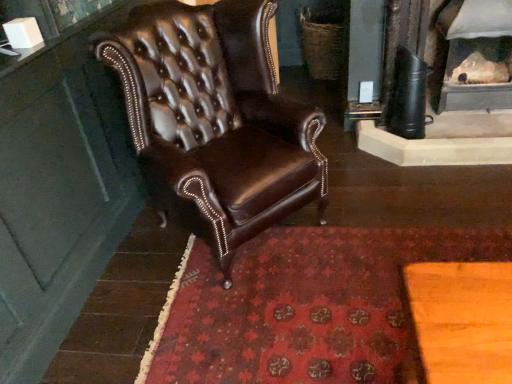
Question: Is red carpet at center shorter than white textured fireplace at upper right?

Choices:
 (A) no
 (B) yes

Answer: (B)

Question: Could you tell me if red carpet at center is turned towards white textured fireplace at upper right?

Choices:
 (A) no
 (B) yes

Answer: (A)

Question: Is red carpet at center at the left side of white textured fireplace at upper right?

Choices:
 (A) no
 (B) yes

Answer: (B)

Question: Considering the relative sizes of red carpet at center and white textured fireplace at upper right in the image provided, is red carpet at center taller than white textured fireplace at upper right?

Choices:
 (A) yes
 (B) no

Answer: (B)

Question: Considering the relative sizes of red carpet at center and white textured fireplace at upper right in the image provided, is red carpet at center bigger than white textured fireplace at upper right?

Choices:
 (A) no
 (B) yes

Answer: (A)

Question: From a real-world perspective, is red carpet at center beneath white textured fireplace at upper right?

Choices:
 (A) no
 (B) yes

Answer: (B)

Question: Is brown leather chair at center oriented away from red carpet at center?

Choices:
 (A) no
 (B) yes

Answer: (A)

Question: From the image's perspective, is brown leather chair at center above red carpet at center?

Choices:
 (A) yes
 (B) no

Answer: (A)

Question: Can you confirm if brown leather chair at center is wider than red carpet at center?

Choices:
 (A) no
 (B) yes

Answer: (A)

Question: From the image's perspective, is brown leather chair at center located beneath red carpet at center?

Choices:
 (A) yes
 (B) no

Answer: (B)

Question: Is red carpet at center inside brown leather chair at center?

Choices:
 (A) yes
 (B) no

Answer: (B)

Question: Can you confirm if brown leather chair at center is thinner than red carpet at center?

Choices:
 (A) no
 (B) yes

Answer: (B)

Question: From the image's perspective, would you say red carpet at center is shown under brown leather chair at center?

Choices:
 (A) no
 (B) yes

Answer: (B)